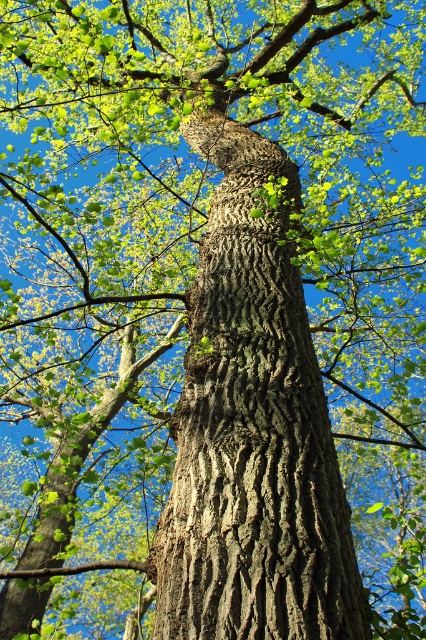
Question: Among these objects, which one is nearest to the camera?

Choices:
 (A) green matte branch at lower left
 (B) dark brown textured bark at center

Answer: (B)

Question: Can you confirm if dark brown textured bark at center is positioned to the left of green matte branch at lower left?

Choices:
 (A) yes
 (B) no

Answer: (B)

Question: Is dark brown textured bark at center below green matte branch at lower left?

Choices:
 (A) yes
 (B) no

Answer: (B)

Question: Does dark brown textured bark at center appear under green matte branch at lower left?

Choices:
 (A) yes
 (B) no

Answer: (B)